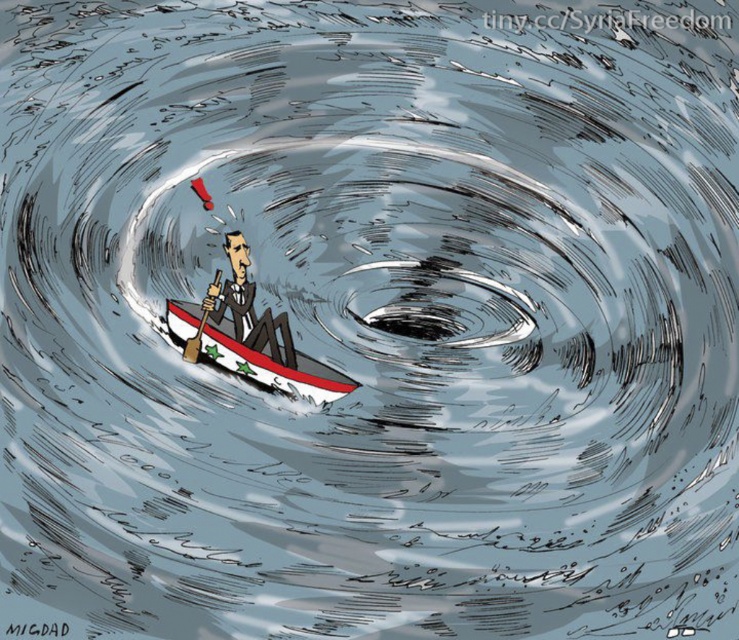
Question: Can you confirm if dark gray suit at center is positioned to the right of brown wood paddle at center?

Choices:
 (A) no
 (B) yes

Answer: (B)

Question: Considering the relative positions of white glossy boat at center and brown wood paddle at center in the image provided, where is white glossy boat at center located with respect to brown wood paddle at center?

Choices:
 (A) above
 (B) below

Answer: (B)

Question: Which object is closer to the camera taking this photo?

Choices:
 (A) white glossy boat at center
 (B) brown wood paddle at center
 (C) dark gray suit at center

Answer: (A)

Question: Which of the following is the farthest from the observer?

Choices:
 (A) (285, 323)
 (B) (202, 330)

Answer: (A)

Question: Does white glossy boat at center appear on the left side of brown wood paddle at center?

Choices:
 (A) no
 (B) yes

Answer: (A)

Question: Considering the real-world distances, which object is farthest from the brown wood paddle at center?

Choices:
 (A) dark gray suit at center
 (B) white glossy boat at center

Answer: (B)